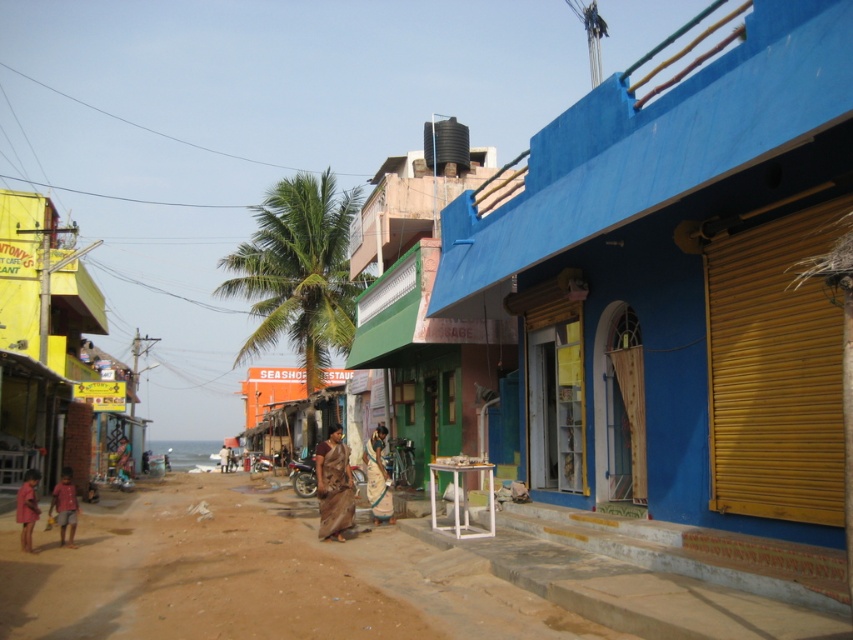
Question: Does red cotton shirt at lower left have a greater width compared to matte pink dress at lower left?

Choices:
 (A) no
 (B) yes

Answer: (B)

Question: Among these points, which one is farthest from the camera?

Choices:
 (A) (335, 449)
 (B) (373, 508)

Answer: (B)

Question: Among these objects, which one is nearest to the camera?

Choices:
 (A) matte pink dress at lower left
 (B) blue painted wall at center

Answer: (B)

Question: Does brown fabric saree at center appear over red cotton shirt at lower left?

Choices:
 (A) no
 (B) yes

Answer: (A)

Question: Estimate the real-world distances between objects in this image. Which object is closer to the green leafy palm tree at center?

Choices:
 (A) brown sandy dirt track at lower left
 (B) yellow corrugated metal hut at left
 (C) brown fabric saree at center
 (D) light brown fabric saree at center

Answer: (B)

Question: In this image, where is blue painted wall at center located relative to yellow corrugated metal hut at left?

Choices:
 (A) left
 (B) right

Answer: (B)